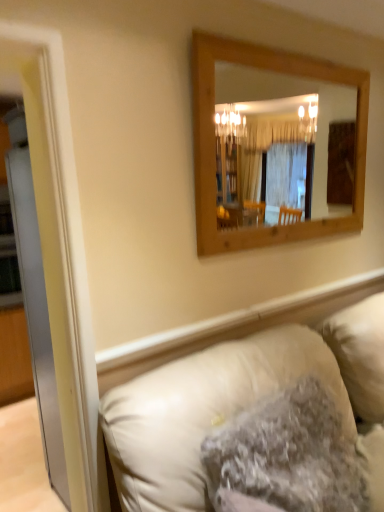
Question: From a real-world perspective, is wooden mirror at upper center above or below leather couch at lower right?

Choices:
 (A) below
 (B) above

Answer: (B)

Question: In terms of size, does wooden mirror at upper center appear bigger or smaller than leather couch at lower right?

Choices:
 (A) big
 (B) small

Answer: (B)

Question: Based on their relative distances, which object is farther from the wooden mirror at upper center?

Choices:
 (A) white glossy door at left
 (B) fuzzy beige pillow at lower center
 (C) leather couch at lower right

Answer: (B)

Question: Which of these objects is positioned closest to the wooden mirror at upper center?

Choices:
 (A) leather couch at lower right
 (B) white glossy door at left
 (C) fuzzy beige pillow at lower center

Answer: (B)